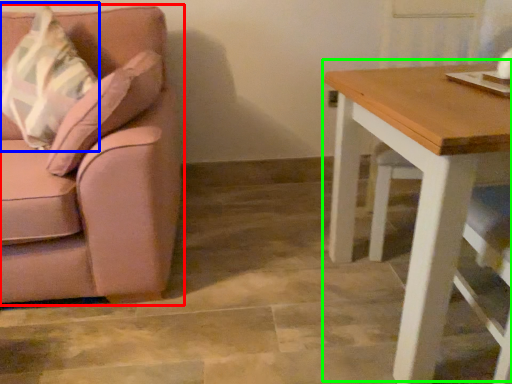
Question: Estimate the real-world distances between objects in this image. Which object is closer to chair (highlighted by a red box), throw pillow (highlighted by a blue box) or table (highlighted by a green box)?

Choices:
 (A) throw pillow
 (B) table

Answer: (A)